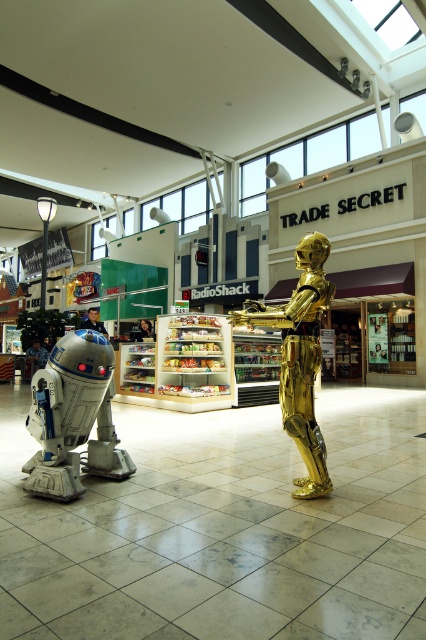
Question: Which of the following is the closest to the observer?

Choices:
 (A) (305, 337)
 (B) (83, 378)

Answer: (A)

Question: Among these points, which one is nearest to the camera?

Choices:
 (A) (77, 342)
 (B) (316, 326)

Answer: (B)

Question: Which point appears farthest from the camera in this image?

Choices:
 (A) (106, 371)
 (B) (304, 317)

Answer: (A)

Question: Where is silver metallic robot at left located in relation to gold metallic statue at center in the image?

Choices:
 (A) left
 (B) right

Answer: (A)

Question: From the image, what is the correct spatial relationship of silver metallic robot at left in relation to gold metallic statue at center?

Choices:
 (A) above
 (B) below

Answer: (B)

Question: Is silver metallic robot at left to the right of gold metallic statue at center from the viewer's perspective?

Choices:
 (A) no
 (B) yes

Answer: (A)